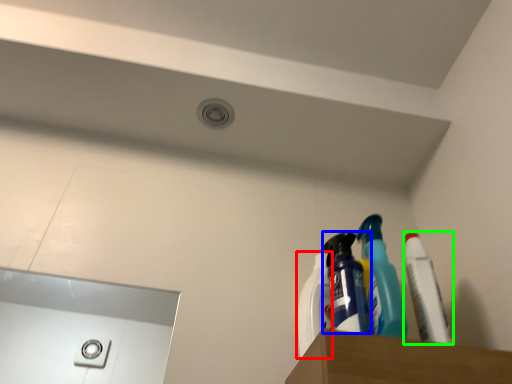
Question: Which is nearer to the cleaning product (highlighted by a red box)? cleaning product (highlighted by a blue box) or toothpaste (highlighted by a green box).

Choices:
 (A) cleaning product
 (B) toothpaste

Answer: (A)